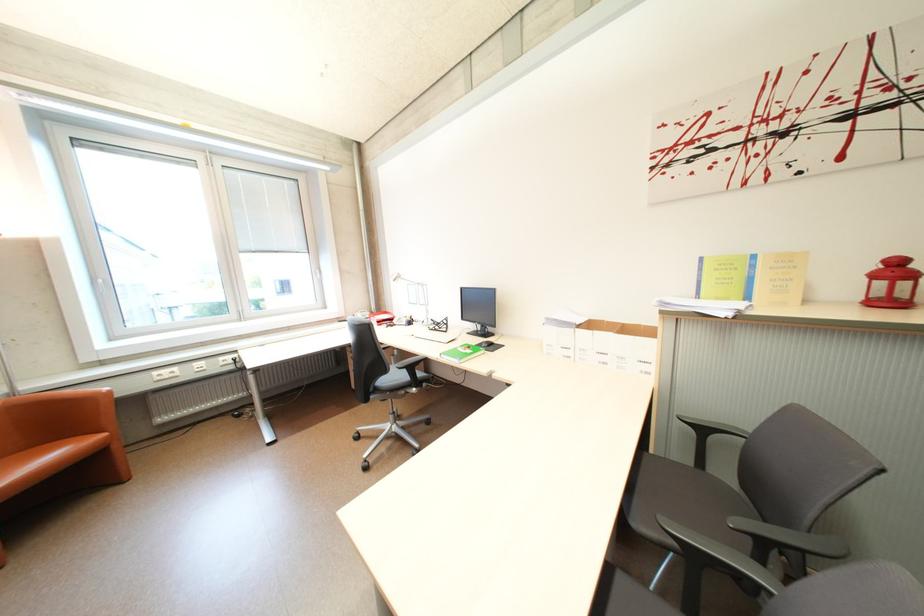
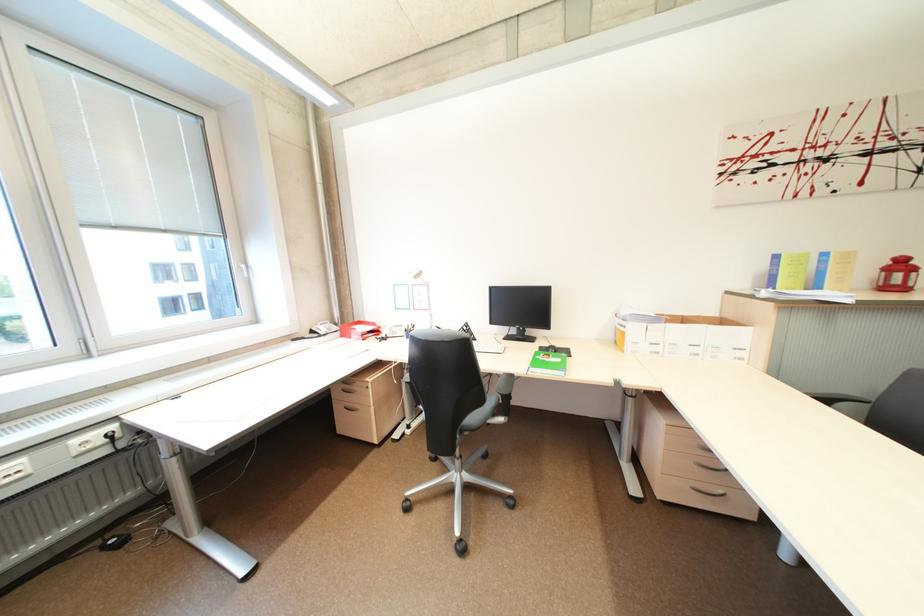
Where in the second image is the point corresponding to the point at 382,314 from the first image?

(345, 325)